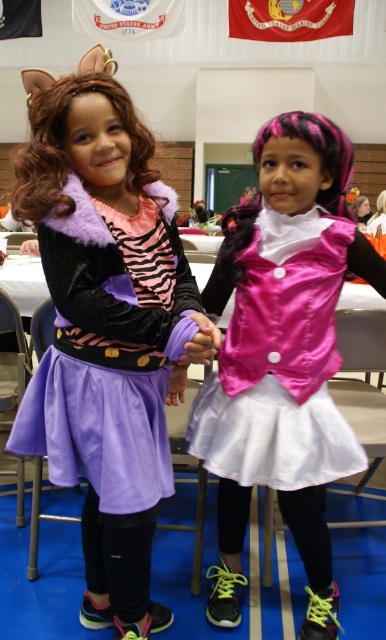
Question: Does purple velvet dress at center have a greater width compared to metallic silver chair at lower center?

Choices:
 (A) no
 (B) yes

Answer: (B)

Question: Which is nearer to the pink satin vest at center?

Choices:
 (A) metallic silver chair at lower center
 (B) purple velvet dress at center

Answer: (B)

Question: Among these objects, which one is farthest from the camera?

Choices:
 (A) purple velvet dress at center
 (B) metallic silver chair at lower center

Answer: (B)

Question: Considering the real-world distances, which object is farthest from the purple velvet dress at center?

Choices:
 (A) pink satin vest at center
 (B) metallic silver chair at lower center

Answer: (B)

Question: Does pink satin vest at center appear on the right side of metallic silver chair at lower center?

Choices:
 (A) yes
 (B) no

Answer: (B)

Question: Does purple velvet dress at center appear on the left side of metallic silver chair at lower center?

Choices:
 (A) yes
 (B) no

Answer: (A)